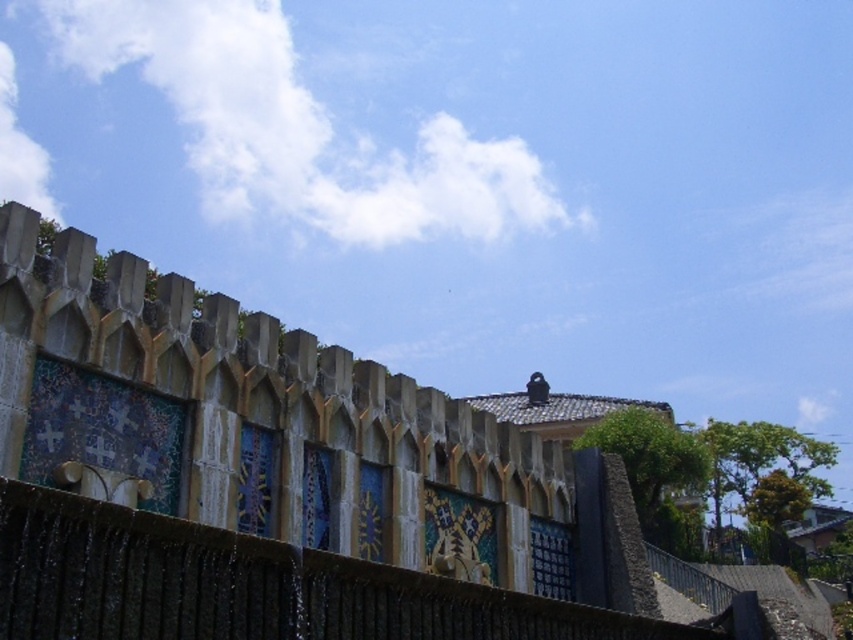
Does point (242, 404) come in front of point (431, 627)?

That is False.

Does smooth concrete fence at center appear under smooth concrete fence at lower center?

No, smooth concrete fence at center is not below smooth concrete fence at lower center.

Does point (136, 456) lie behind point (289, 588)?

Yes, it is.

Find the location of a particular element. Image resolution: width=853 pixels, height=640 pixels. smooth concrete fence at center is located at coordinates (276, 481).